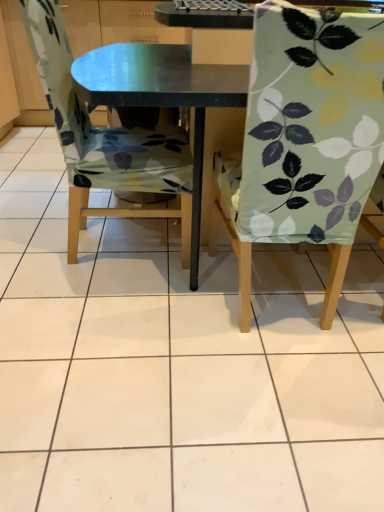
Question: Is light green fabric chair at right, the second chair in the left-to-right sequence, in front of or behind floral fabric chair at left, the first chair from the left, in the image?

Choices:
 (A) behind
 (B) front

Answer: (B)

Question: Based on their sizes in the image, would you say light green fabric chair at right, the second chair in the left-to-right sequence, is bigger or smaller than floral fabric chair at left, which ranks as the second chair in right-to-left order?

Choices:
 (A) small
 (B) big

Answer: (A)

Question: Does point (339, 105) appear closer or farther from the camera than point (94, 181)?

Choices:
 (A) farther
 (B) closer

Answer: (B)

Question: From the image's perspective, is floral fabric chair at left, the first chair from the left, positioned above or below light green fabric chair at right, the second chair in the left-to-right sequence?

Choices:
 (A) above
 (B) below

Answer: (A)

Question: Is point (48, 82) positioned closer to the camera than point (352, 212)?

Choices:
 (A) farther
 (B) closer

Answer: (A)

Question: Is floral fabric chair at left, which ranks as the second chair in right-to-left order, bigger or smaller than light green fabric chair at right, the 1th chair from the right?

Choices:
 (A) small
 (B) big

Answer: (B)

Question: From their relative heights in the image, would you say floral fabric chair at left, which ranks as the second chair in right-to-left order, is taller or shorter than light green fabric chair at right, the second chair in the left-to-right sequence?

Choices:
 (A) short
 (B) tall

Answer: (A)